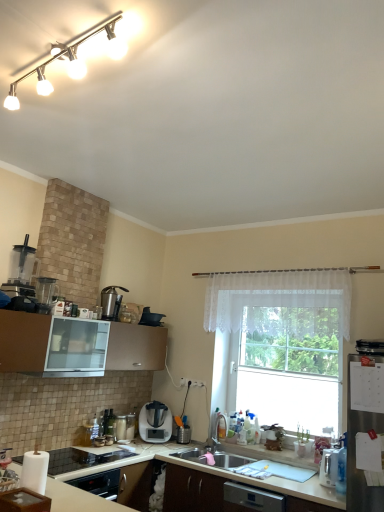
What are the coordinates of `vacant region above white glossy track lights at upper left (from a real-world perspective)` in the screenshot? It's located at tap(72, 52).